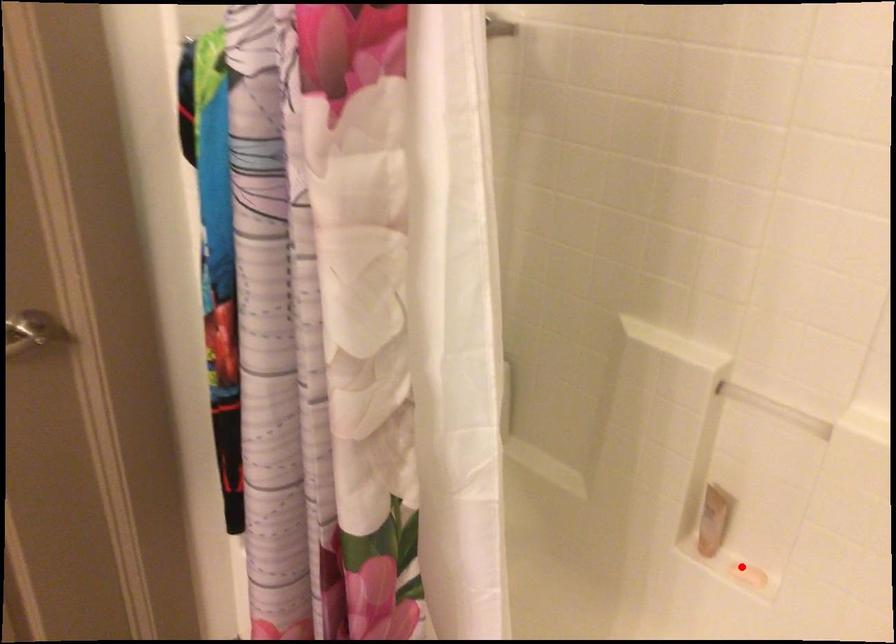
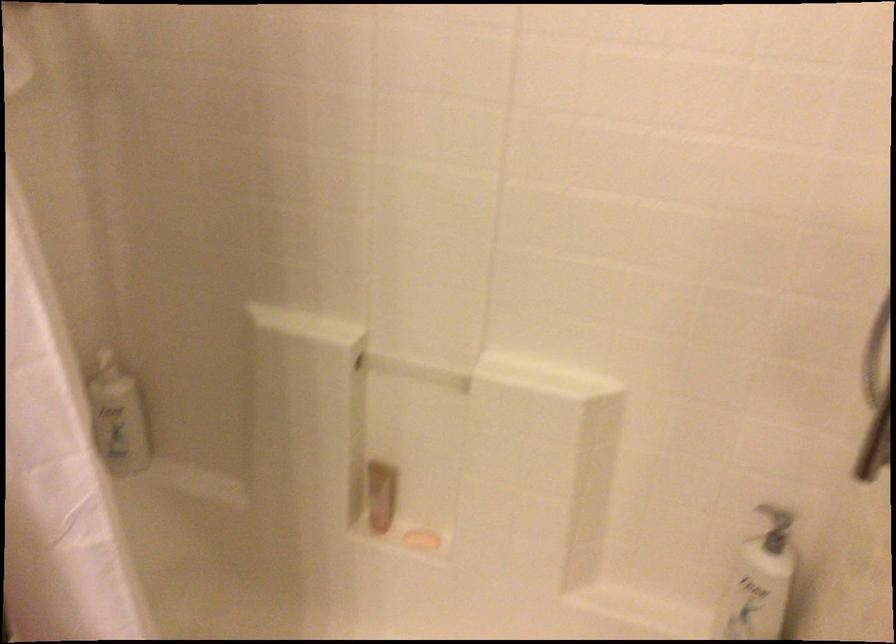
Locate, in the second image, the point that corresponds to the highlighted location in the first image.

(421, 540)